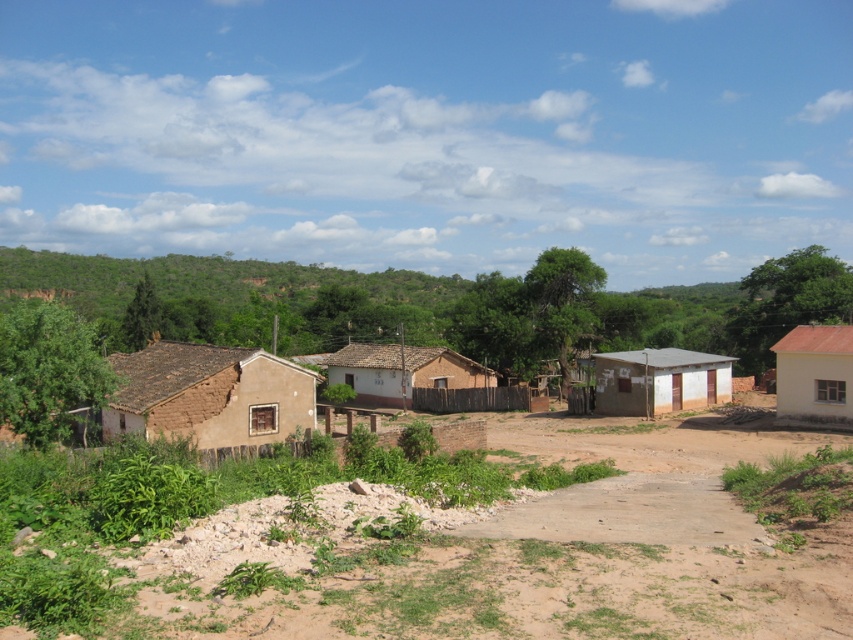
Image resolution: width=853 pixels, height=640 pixels. What do you see at coordinates (209, 394) in the screenshot?
I see `brown mud hut at left` at bounding box center [209, 394].

Between brown mud hut at left and brown mud house at left, which one appears on the left side from the viewer's perspective?

brown mud hut at left

Who is more forward, [245,420] or [755,449]?

Point [755,449] is more forward.

Locate an element on the screen. The image size is (853, 640). brown mud hut at left is located at coordinates coord(209,394).

Can you confirm if brown dirt field at center is taller than brown mud house at left?

In fact, brown dirt field at center may be shorter than brown mud house at left.

Is brown dirt field at center bigger than brown mud house at left?

Incorrect, brown dirt field at center is not larger than brown mud house at left.

Locate an element on the screen. The width and height of the screenshot is (853, 640). brown dirt field at center is located at coordinates (492, 550).

Where is `white matte house at right`? The width and height of the screenshot is (853, 640). white matte house at right is located at coordinates (814, 376).

Is white matte house at right thinner than brown mud hut at center?

Correct, white matte house at right's width is less than brown mud hut at center's.

Measure the distance between white matte house at right and camera.

white matte house at right and camera are 38.69 meters apart from each other.

The width and height of the screenshot is (853, 640). I want to click on white matte house at right, so click(814, 376).